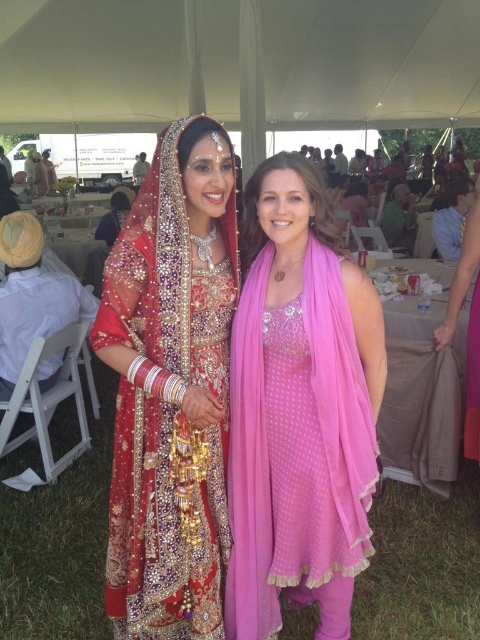
Question: Among these objects, which one is nearest to the camera?

Choices:
 (A) matte gold jewelry at center
 (B) pink sheer scarf at center

Answer: (A)

Question: From the image, what is the correct spatial relationship of matte gold jewelry at center in relation to white fabric canopy at upper center?

Choices:
 (A) left
 (B) right

Answer: (A)

Question: Which of these objects is positioned farthest from the pink sheer scarf at center?

Choices:
 (A) matte gold jewelry at center
 (B) white fabric canopy at upper center

Answer: (B)

Question: Among these objects, which one is nearest to the camera?

Choices:
 (A) matte gold jewelry at center
 (B) white fabric canopy at upper center

Answer: (A)

Question: Can you confirm if pink sheer scarf at center is smaller than white fabric canopy at upper center?

Choices:
 (A) yes
 (B) no

Answer: (A)

Question: Does matte gold jewelry at center have a greater width compared to white fabric canopy at upper center?

Choices:
 (A) no
 (B) yes

Answer: (A)